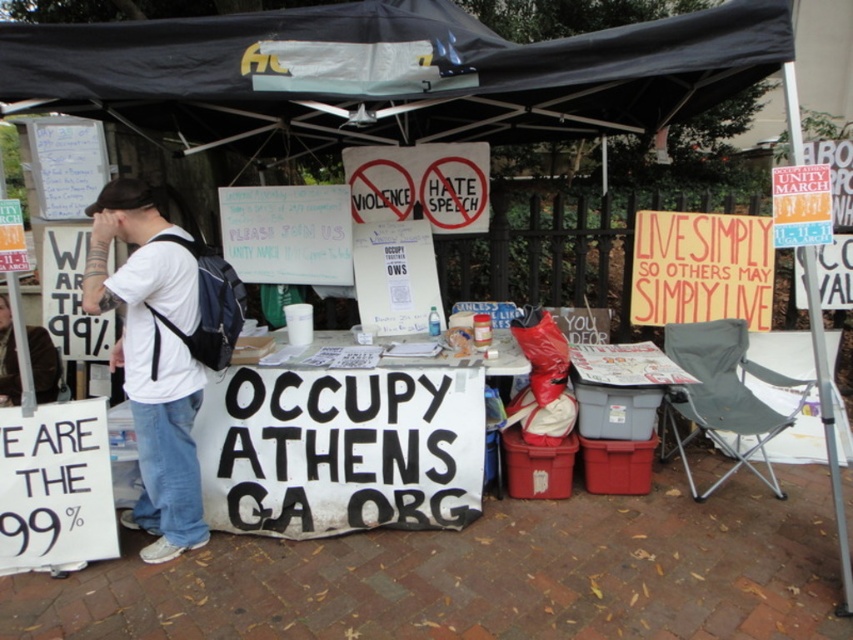
This screenshot has height=640, width=853. I want to click on black fabric canopy at upper center, so pos(395,81).

Between black fabric canopy at upper center and white t-shirt at left, which one has more height?

With more height is white t-shirt at left.

Which is behind, point (769, 1) or point (126, 355)?

Point (126, 355)

Find the location of a particular element. The width and height of the screenshot is (853, 640). black fabric canopy at upper center is located at coordinates (395, 81).